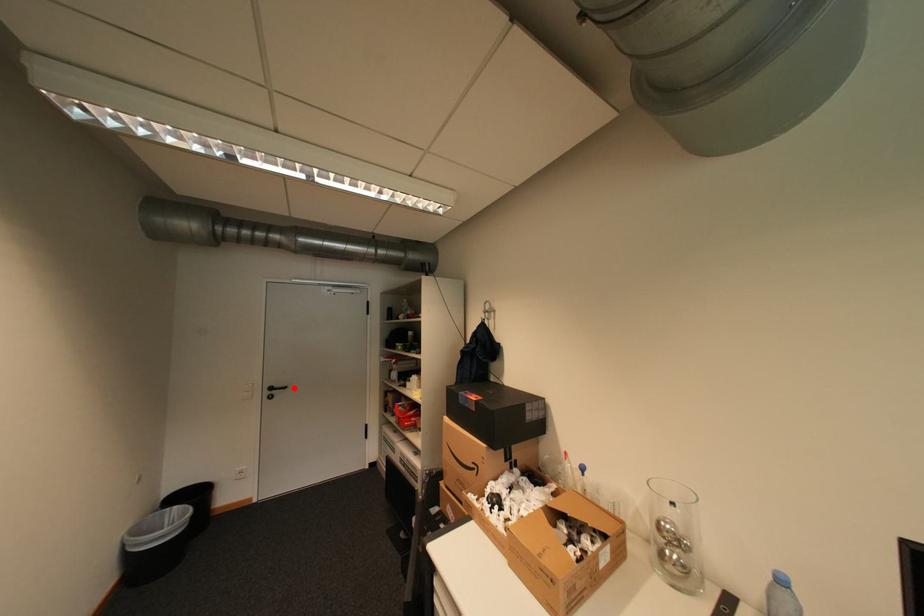
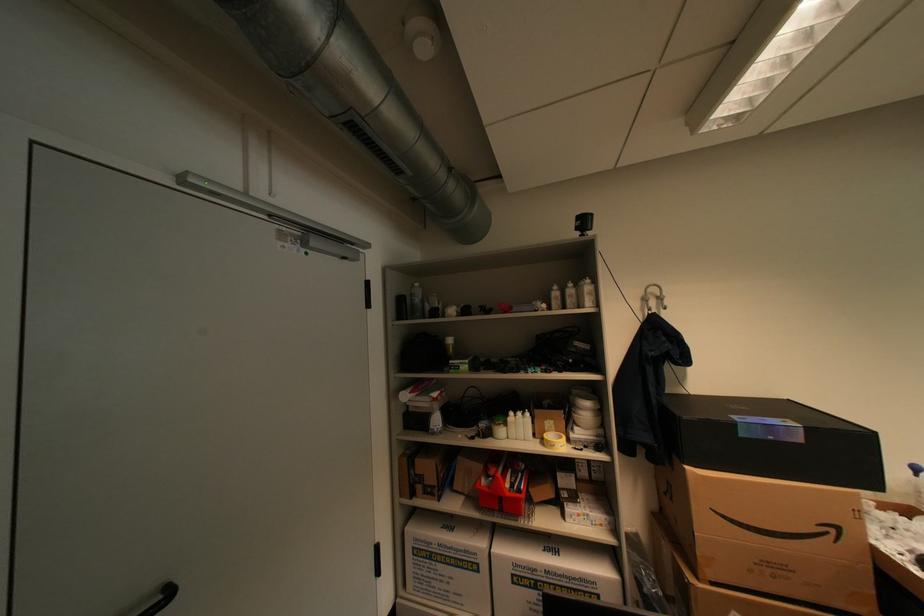
Find the pixel in the second image that matches the highlighted location in the first image.

(176, 594)